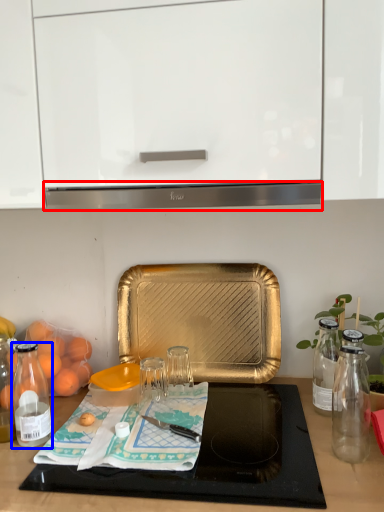
Question: Which object is closer to the camera taking this photo, exhaust hood (highlighted by a red box) or bottle (highlighted by a blue box)?

Choices:
 (A) exhaust hood
 (B) bottle

Answer: (A)